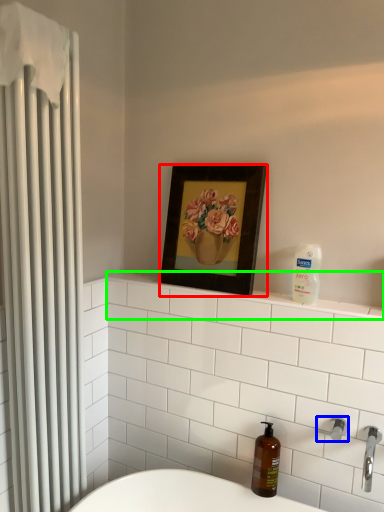
Question: Based on their relative distances, which object is nearer to picture frame (highlighted by a red box)? Choose from shower (highlighted by a blue box) and balustrade (highlighted by a green box).

Choices:
 (A) shower
 (B) balustrade

Answer: (B)